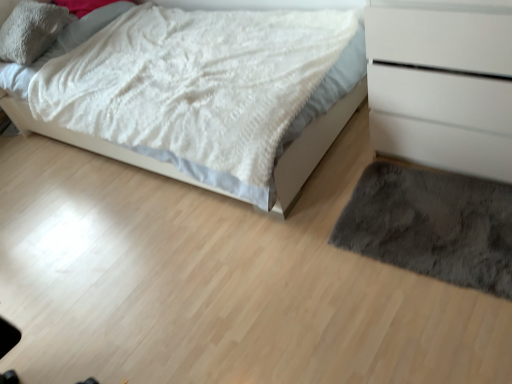
Locate an element on the screen. This screenshot has width=512, height=384. vacant space in dark gray shaggy rug at lower right (from a real-world perspective) is located at coordinates (421, 240).